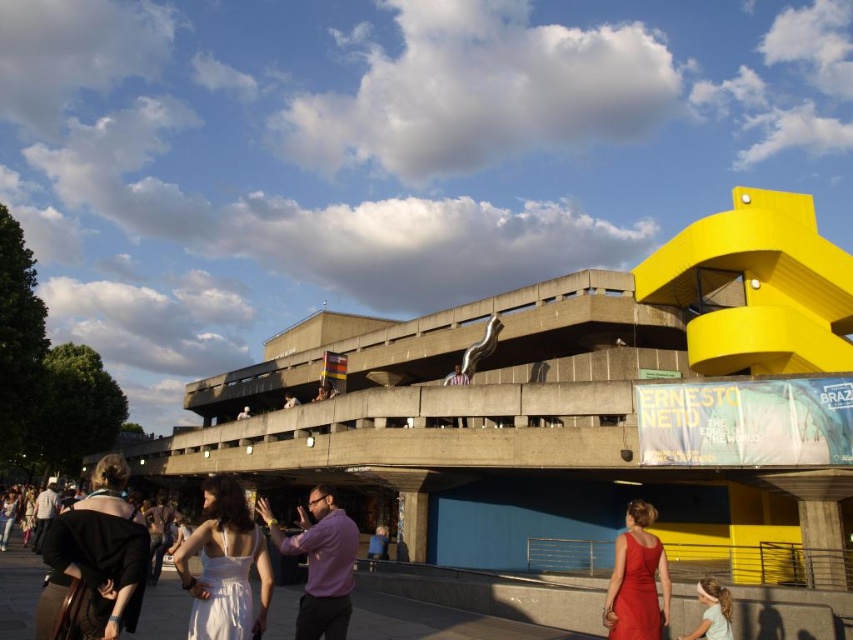
Question: Estimate the real-world distances between objects in this image. Which object is closer to the matte white dress at center?

Choices:
 (A) matte red dress at lower center
 (B) white fabric shirt at center
 (C) purple matte shirt at center

Answer: (C)

Question: Can you confirm if light blue fabric dress at lower right is smaller than white fabric shirt at center?

Choices:
 (A) yes
 (B) no

Answer: (A)

Question: Can you confirm if purple matte shirt at center is smaller than matte red dress at lower center?

Choices:
 (A) yes
 (B) no

Answer: (B)

Question: Can you confirm if purple matte shirt at center is positioned below matte white dress at center?

Choices:
 (A) yes
 (B) no

Answer: (A)

Question: Which point appears farthest from the camera in this image?

Choices:
 (A) (218, 536)
 (B) (653, 637)
 (C) (721, 609)
 (D) (241, 416)

Answer: (D)

Question: Which object appears closest to the camera in this image?

Choices:
 (A) purple matte shirt at center
 (B) black fabric dress at lower left

Answer: (B)